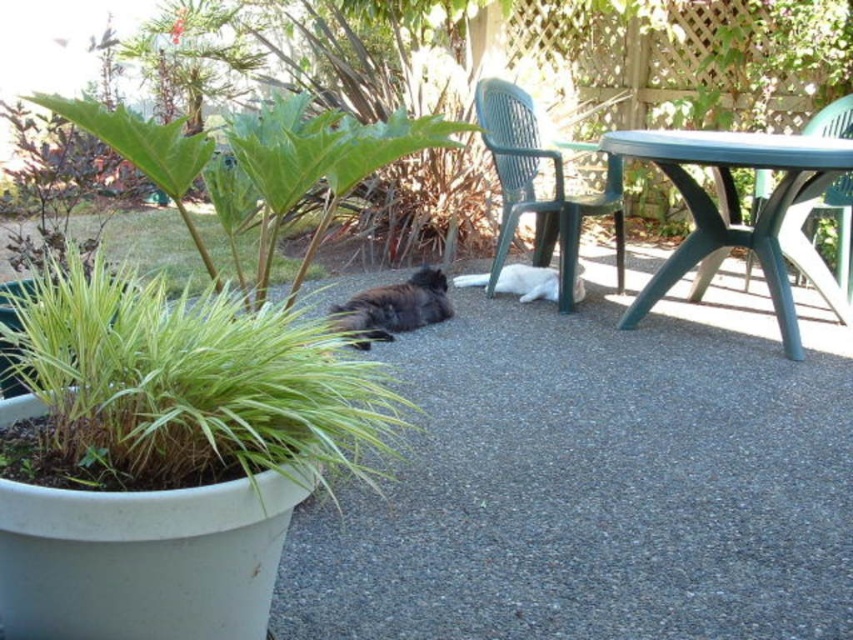
You are standing at the origin point of the image coordinate system. You want to move to the green plastic chair at center. What are the coordinates you need to move to?

The coordinates to move to are 0.280 in the x direction and 0.626 in the y direction.

You are standing on the gravel surface where the cats are resting. You want to walk to the green plastic chair at upper right. Which direction should you walk to avoid stepping on the green leafy grass at center?

You should walk to the right of the green leafy grass at center since it is to the left of the green plastic chair at upper right, so moving right would bypass it.

You are standing at the center of the patio and see the point at coordinates point (532, 179). Which object is this point located on?

The point (532, 179) is located on the green plastic chair at center.